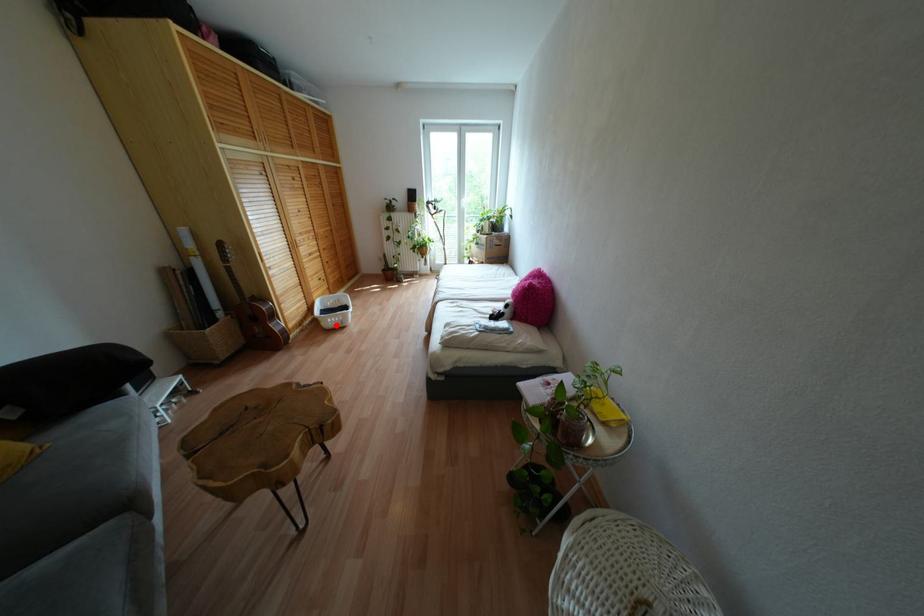
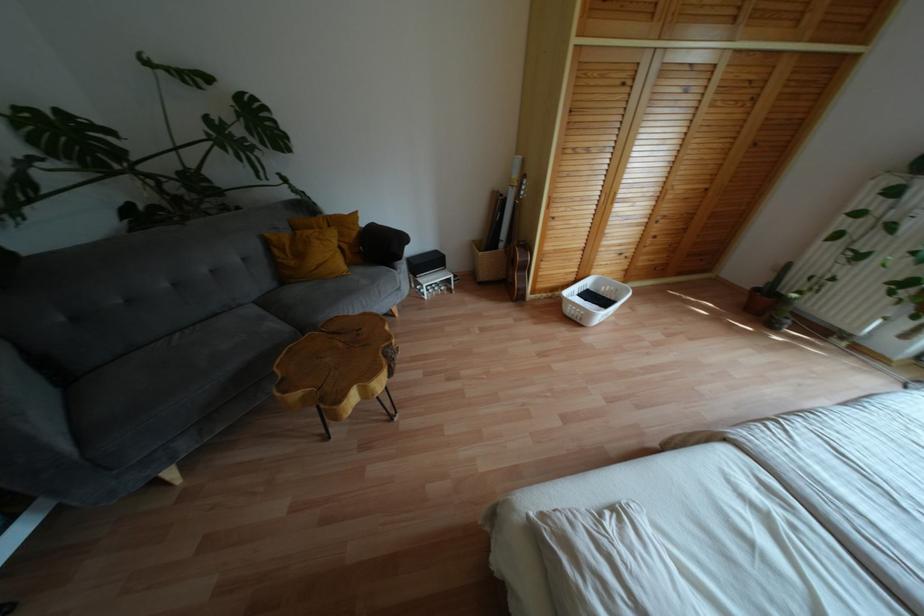
Question: I am providing you with two images of the same scene from different viewpoints. A red point is shown in image1. For the corresponding object point in image2, is it positioned nearer or farther from the camera?

Choices:
 (A) Nearer
 (B) Farther

Answer: (B)